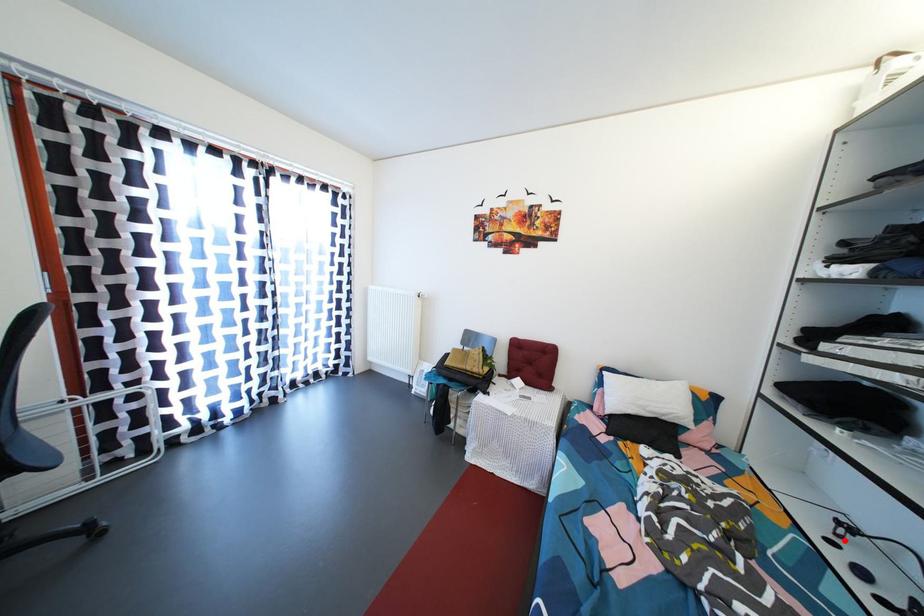
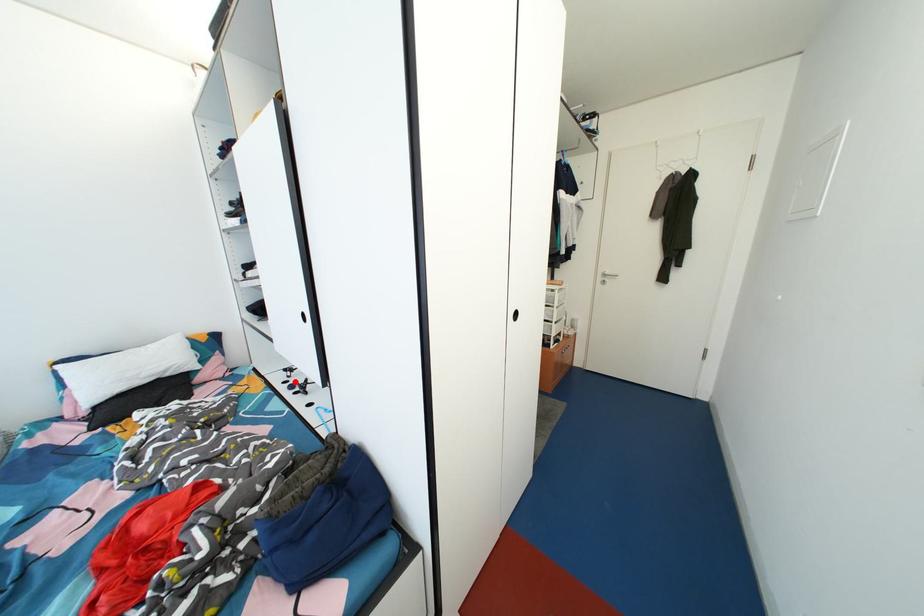
I am providing you with two images of the same scene from different viewpoints. A red point is marked on the first image and another point is marked on the second image. Is the red point in image1 aligned with the point shown in image2?

Yes